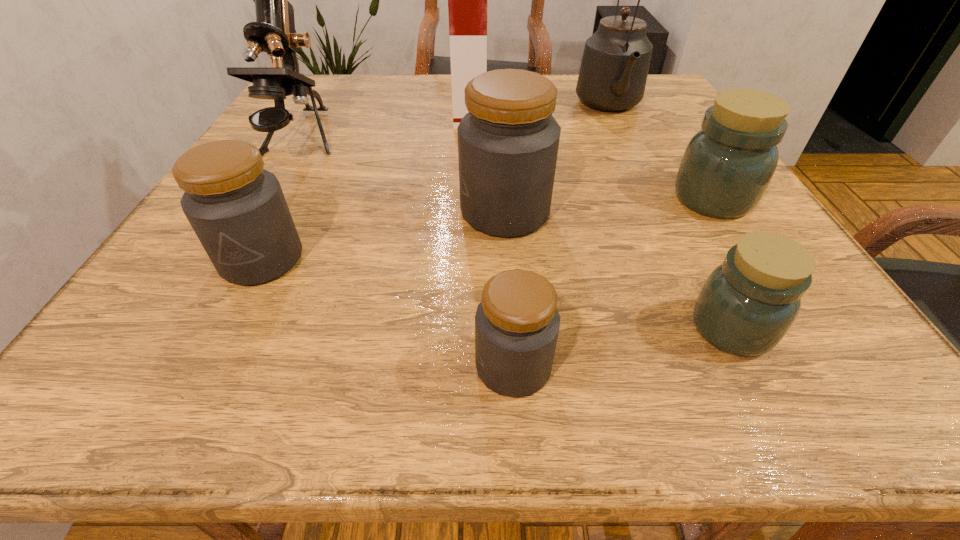
At what (x,y) coordinates should I click in order to perform the action: click on vacant space that satisfies the following two spatial constraints: 1. spout on the kettle; 2. on the right side of the smaller green jar. Please return your answer as a coordinate pair (x, y). The image size is (960, 540). Looking at the image, I should click on (715, 328).

The width and height of the screenshot is (960, 540). I want to click on blank space that satisfies the following two spatial constraints: 1. on the front-facing side of the nearer green jar; 2. on the left side of the cigarette_case, so click(x=463, y=328).

Image resolution: width=960 pixels, height=540 pixels. Find the location of `free space that satisfies the following two spatial constraints: 1. on the surface of the fourth tallest object near the warning symbol; 2. on the surface of the leftmost gray jar near the warning symbol`. free space that satisfies the following two spatial constraints: 1. on the surface of the fourth tallest object near the warning symbol; 2. on the surface of the leftmost gray jar near the warning symbol is located at coordinates (509, 260).

At what (x,y) coordinates should I click in order to perform the action: click on free space that satisfies the following two spatial constraints: 1. spout on the kettle; 2. on the right side of the smaller green jar. Please return your answer as a coordinate pair (x, y). Looking at the image, I should click on (715, 328).

Image resolution: width=960 pixels, height=540 pixels. In order to click on vacant space that satisfies the following two spatial constraints: 1. on the front-facing side of the red cigarette_case; 2. on the surface of the leftmost gray jar near the warning symbol in this screenshot , I will do `click(466, 260)`.

Identify the location of vacant space that satisfies the following two spatial constraints: 1. on the front-facing side of the cigarette_case; 2. on the back side of the farther green jar. The height and width of the screenshot is (540, 960). click(468, 199).

I want to click on vacant space that satisfies the following two spatial constraints: 1. on the front side of the farther green jar; 2. on the surface of the smallest gray jar near the warning symbol, so click(819, 366).

Find the location of `free point that satisfies the following two spatial constraints: 1. on the front-facing side of the smaller green jar; 2. on the right side of the red cigarette_case`. free point that satisfies the following two spatial constraints: 1. on the front-facing side of the smaller green jar; 2. on the right side of the red cigarette_case is located at coordinates (463, 328).

The width and height of the screenshot is (960, 540). I want to click on free space that satisfies the following two spatial constraints: 1. spout on the kettle; 2. on the surface of the nearest gray jar near the warning symbol, so click(733, 366).